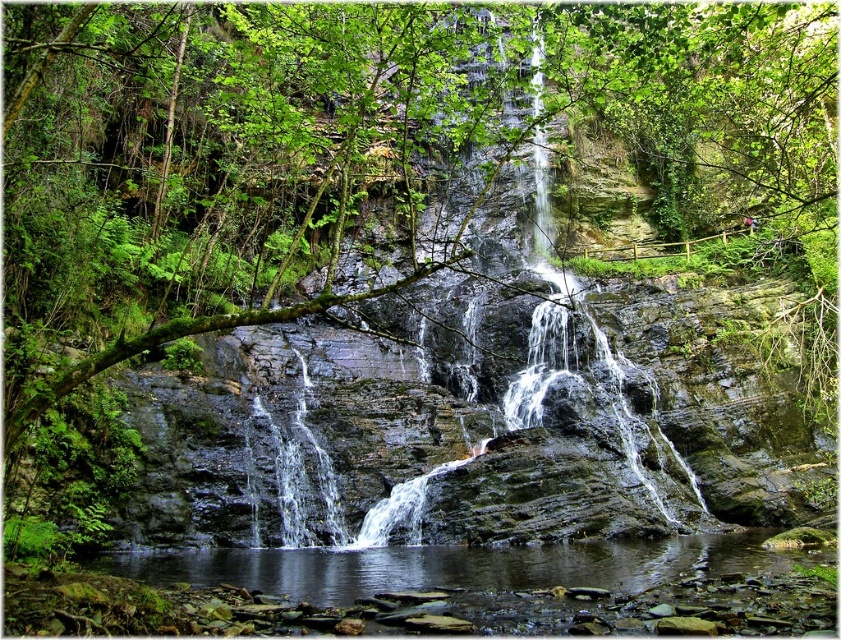
Question: Does smooth rock waterfall at center lie in front of clear water at bottom?

Choices:
 (A) no
 (B) yes

Answer: (B)

Question: Can you confirm if smooth rock waterfall at center is positioned below clear water at bottom?

Choices:
 (A) no
 (B) yes

Answer: (A)

Question: Can you confirm if smooth rock waterfall at center is positioned to the left of clear water at bottom?

Choices:
 (A) no
 (B) yes

Answer: (A)

Question: Among these objects, which one is farthest from the camera?

Choices:
 (A) smooth rock waterfall at center
 (B) clear water at bottom

Answer: (B)

Question: Which point is closer to the camera taking this photo?

Choices:
 (A) (368, 460)
 (B) (155, 563)

Answer: (B)